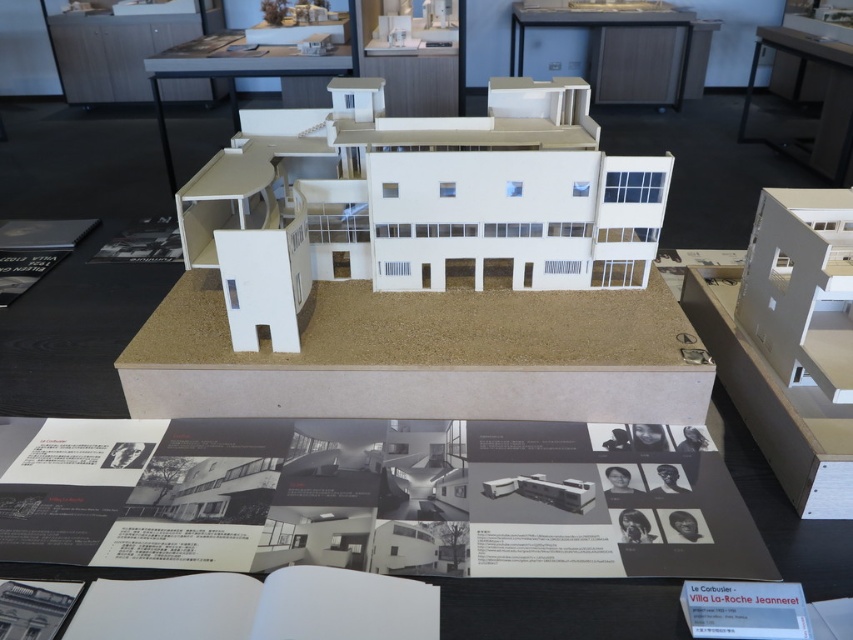
Does point (39, 476) lie in front of point (762, 35)?

Yes, point (39, 476) is in front of point (762, 35).

Who is positioned more to the left, black paper book at center or black glossy table at upper right?

From the viewer's perspective, black paper book at center appears more on the left side.

This screenshot has height=640, width=853. What are the coordinates of `black paper book at center` in the screenshot? It's located at (380, 499).

At what (x,y) coordinates should I click in order to perform the action: click on black paper book at center. Please return your answer as a coordinate pair (x, y). This screenshot has height=640, width=853. Looking at the image, I should click on (380, 499).

Which is in front, point (24, 536) or point (698, 86)?

Positioned in front is point (24, 536).

Is black paper book at center to the right of light brown wooden table at upper center from the viewer's perspective?

In fact, black paper book at center is to the left of light brown wooden table at upper center.

The height and width of the screenshot is (640, 853). What do you see at coordinates (380, 499) in the screenshot?
I see `black paper book at center` at bounding box center [380, 499].

This screenshot has width=853, height=640. In order to click on black paper book at center in this screenshot , I will do `click(380, 499)`.

Does point (714, 544) come behind point (108, 253)?

No.

Is black paper book at center shorter than matte black book at upper left?

Yes, black paper book at center is shorter than matte black book at upper left.

Who is more distant from viewer, (621, 468) or (160, 237)?

The point (160, 237) is behind.

This screenshot has height=640, width=853. What are the coordinates of `black paper book at center` in the screenshot? It's located at (380, 499).